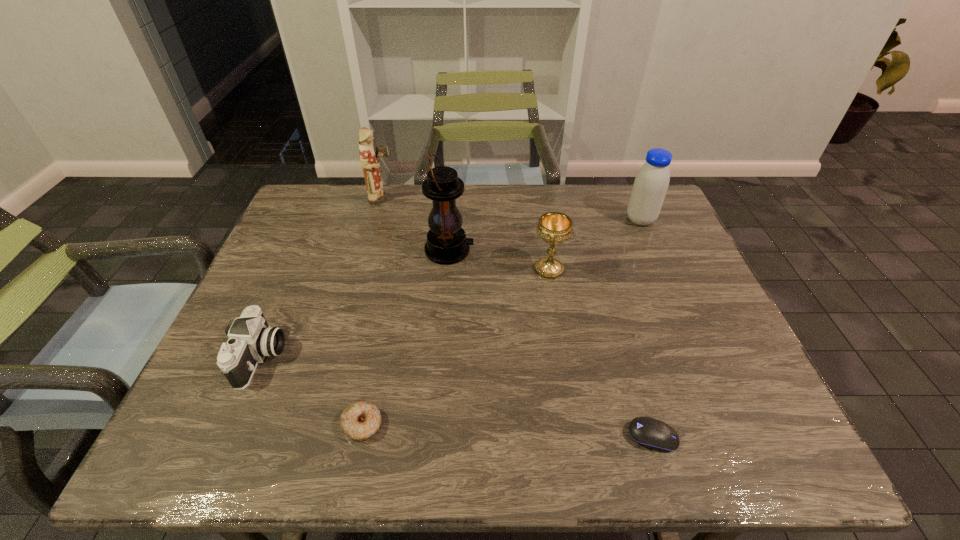
At what (x,y) coordinates should I click in order to perform the action: click on the third object from left to right. Please return your answer as a coordinate pair (x, y). Image resolution: width=960 pixels, height=540 pixels. Looking at the image, I should click on (360, 420).

At what (x,y) coordinates should I click in order to perform the action: click on computer mouse. Please return your answer as a coordinate pair (x, y). The height and width of the screenshot is (540, 960). Looking at the image, I should click on (648, 432).

Identify some points within the free space located above the lantern, indicating its light source. Please provide its 2D coordinates. Your answer should be formatted as a tuple, i.e. [(x, y)], where the tuple contains the x and y coordinates of a point satisfying the conditions above.

[(614, 250)]

Identify the location of free space located on the front-facing side of the sixth object from right to left. The image size is (960, 540). (424, 199).

Find the location of a particular element. This screenshot has width=960, height=540. blank space located on the front of the rightmost object is located at coordinates (653, 248).

This screenshot has height=540, width=960. I want to click on free space located on the left of the chalice, so click(x=503, y=269).

Locate an element on the screen. blank area located 0.220m on the right of the leftmost object is located at coordinates (380, 357).

Where is `vacant space located 0.090m on the left of the doughnut`? Image resolution: width=960 pixels, height=540 pixels. vacant space located 0.090m on the left of the doughnut is located at coordinates (297, 424).

I want to click on vacant space positioned 0.210m on the back of the computer mouse, so click(624, 338).

This screenshot has height=540, width=960. I want to click on figurine located in the far edge section of the desktop, so click(x=368, y=158).